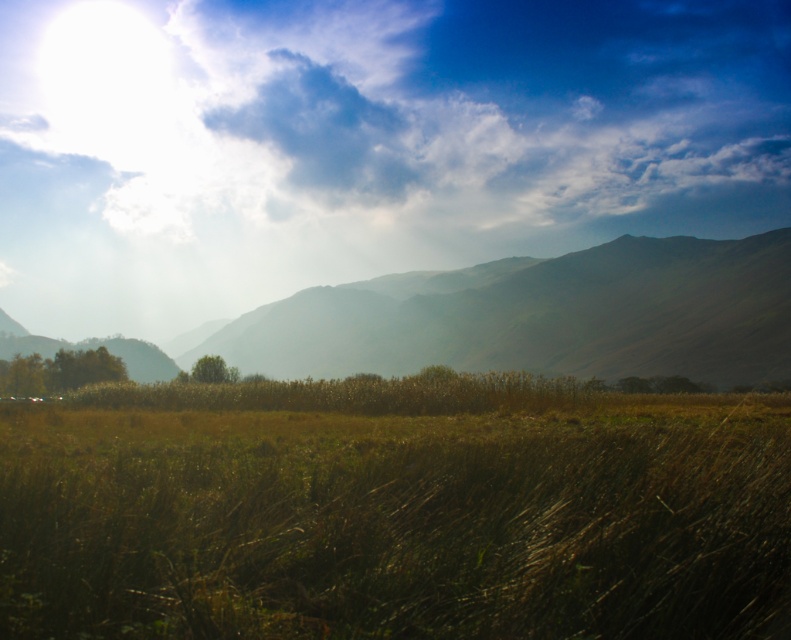
You are an environmental scientist analyzing the landscape. You observe the brown dry grass at center and the green matte mountain at center. Which of these two objects has a smaller width in the image?

The brown dry grass at center is thinner than the green matte mountain at center, so the brown dry grass at center has a smaller width.

You are an astronomer analyzing the sky in the image. You need to locate the white fluffy cloud at upper center for your research. What are its coordinates?

The white fluffy cloud at upper center is located at coordinates point (364, 144).